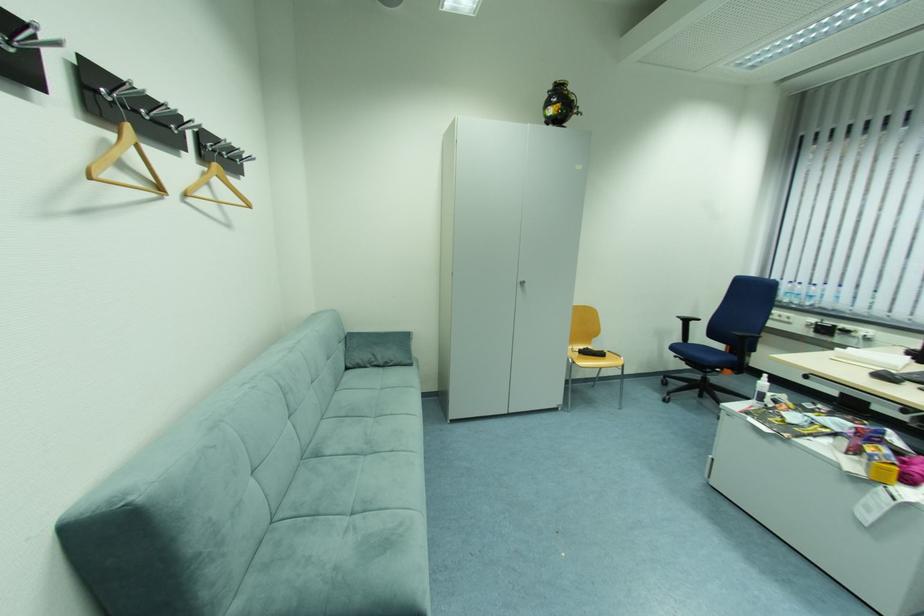
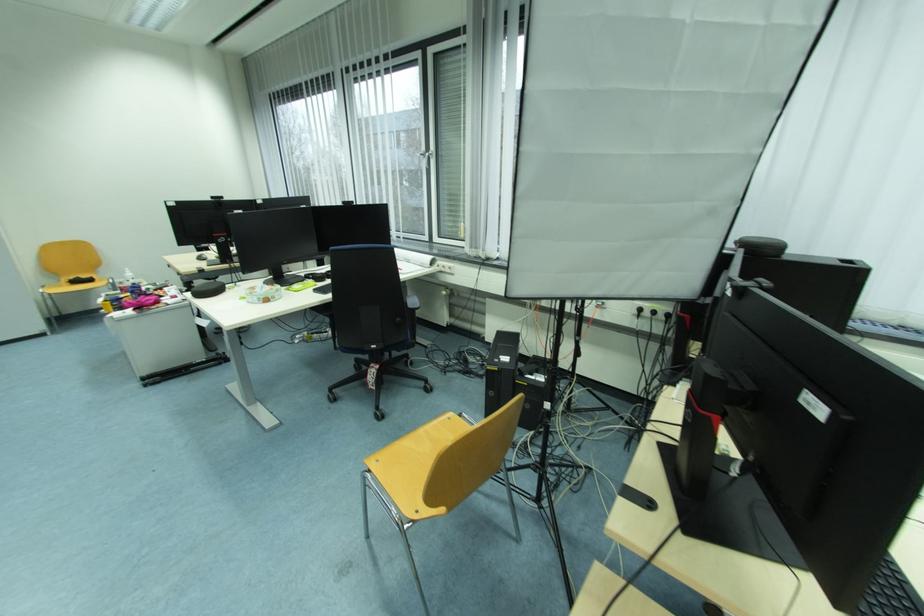
Locate, in the second image, the point that corresponds to pixel 608 355 in the first image.

(96, 282)